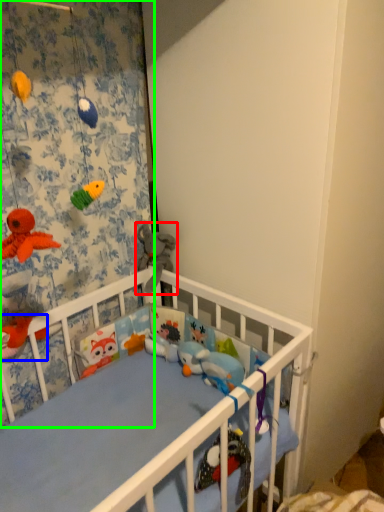
Question: Considering the real-world distances, which object is closest to toy (highlighted by a red box)? toy (highlighted by a blue box) or curtain (highlighted by a green box).

Choices:
 (A) toy
 (B) curtain

Answer: (B)